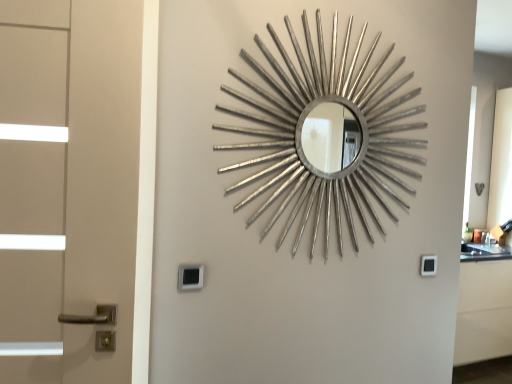
Describe the element at coordinates (325, 135) in the screenshot. I see `silver metallic mirror at center` at that location.

This screenshot has height=384, width=512. Identify the location of silver metallic mirror at center. (325, 135).

Considering the positions of objects black plastic lock at lower right, which is the second lock from left to right, and silver metallic mirror at center in the image provided, who is more to the left, black plastic lock at lower right, which is the second lock from left to right, or silver metallic mirror at center?

From the viewer's perspective, silver metallic mirror at center appears more on the left side.

Is black plastic lock at lower right, the 1th lock in the back-to-front sequence, closer to camera compared to silver metallic mirror at center?

That is False.

Can you confirm if black plastic lock at lower right, the 1th lock in the back-to-front sequence, is thinner than silver metallic mirror at center?

Yes.

From a real-world perspective, count 2nd locks downward from the silver metallic mirror at center and point to it. Please provide its 2D coordinates.

[(428, 265)]

Between black plastic lock at lower center, which appears as the 1th lock when viewed from the left, and black plastic lock at lower right, which is counted as the first lock, starting from the right, which one has more height?

black plastic lock at lower center, which appears as the 1th lock when viewed from the left, is taller.

In the scene shown: Considering the sizes of objects black plastic lock at lower center, the second lock in the right-to-left sequence, and black plastic lock at lower right, which is the second lock from left to right, in the image provided, who is smaller, black plastic lock at lower center, the second lock in the right-to-left sequence, or black plastic lock at lower right, which is the second lock from left to right,?

With smaller size is black plastic lock at lower right, which is the second lock from left to right.

Where is `lock in front of the black plastic lock at lower right, the 2th lock viewed from the front`? This screenshot has height=384, width=512. lock in front of the black plastic lock at lower right, the 2th lock viewed from the front is located at coordinates (190, 277).

Are black plastic lock at lower center, which appears as the 1th lock when viewed from the left, and black plastic lock at lower right, the 1th lock in the back-to-front sequence, making contact?

black plastic lock at lower center, which appears as the 1th lock when viewed from the left, and black plastic lock at lower right, the 1th lock in the back-to-front sequence, are clearly separated.

Which is correct: black plastic lock at lower right, the 2th lock viewed from the front, is inside black plastic lock at lower center, which appears as the 1th lock when viewed from the left, or outside of it?

The correct answer is: outside.

How far apart are black plastic lock at lower right, which is the second lock from left to right, and black plastic lock at lower center, arranged as the first lock when viewed from the front?

3.30 feet.

Is black plastic lock at lower right, which is the second lock from left to right, to the right of black plastic lock at lower center, which appears as the 1th lock when viewed from the left, from the viewer's perspective?

Yes.

Is black plastic lock at lower right, which is the second lock from left to right, with black plastic lock at lower center, the second lock in the right-to-left sequence?

No, black plastic lock at lower right, which is the second lock from left to right, is not next to black plastic lock at lower center, the second lock in the right-to-left sequence.

From the image's perspective, which is above, silver metallic mirror at center or black plastic lock at lower center, which appears as the 1th lock when viewed from the left?

silver metallic mirror at center appears higher in the image.

Consider the image. Is silver metallic mirror at center positioned with its back to black plastic lock at lower center, the second lock in the right-to-left sequence?

silver metallic mirror at center does not have its back to black plastic lock at lower center, the second lock in the right-to-left sequence.

Between point (259, 64) and point (186, 269), which one is positioned in front?

Positioned in front is point (186, 269).

Can you tell me how much silver metallic mirror at center and black plastic lock at lower center, the second lock in the right-to-left sequence, differ in facing direction?

0.174 degrees separate the facing orientations of silver metallic mirror at center and black plastic lock at lower center, the second lock in the right-to-left sequence.

Is black plastic lock at lower center, arranged as the first lock when viewed from the front, positioned beyond the bounds of silver metallic mirror at center?

Absolutely, black plastic lock at lower center, arranged as the first lock when viewed from the front, is external to silver metallic mirror at center.

Where is `design that is above the black plastic lock at lower center, which appears as the 2th lock when viewed from the back (from the image's perspective)`? design that is above the black plastic lock at lower center, which appears as the 2th lock when viewed from the back (from the image's perspective) is located at coordinates (325, 135).

Is point (186, 278) behind point (298, 233)?

No, it is in front of (298, 233).

Is the position of black plastic lock at lower center, which appears as the 2th lock when viewed from the back, less distant than that of silver metallic mirror at center?

No, black plastic lock at lower center, which appears as the 2th lock when viewed from the back, is behind silver metallic mirror at center.

Looking at the image, does silver metallic mirror at center seem bigger or smaller compared to black plastic lock at lower right, which is counted as the first lock, starting from the right?

Clearly, silver metallic mirror at center is larger in size than black plastic lock at lower right, which is counted as the first lock, starting from the right.

Measure the distance between silver metallic mirror at center and black plastic lock at lower right, the 2th lock viewed from the front.

The distance of silver metallic mirror at center from black plastic lock at lower right, the 2th lock viewed from the front, is 26.83 inches.

In the image, is silver metallic mirror at center on the left side or the right side of black plastic lock at lower right, the 1th lock in the back-to-front sequence?

Clearly, silver metallic mirror at center is on the left of black plastic lock at lower right, the 1th lock in the back-to-front sequence, in the image.

From the image's perspective, which is below, silver metallic mirror at center or black plastic lock at lower right, which is counted as the first lock, starting from the right?

black plastic lock at lower right, which is counted as the first lock, starting from the right, is shown below in the image.

The image size is (512, 384). In order to click on design on the left of black plastic lock at lower right, the 2th lock viewed from the front in this screenshot , I will do `click(325, 135)`.

Locate an element on the screen. This screenshot has width=512, height=384. lock above the black plastic lock at lower right, which is counted as the first lock, starting from the right (from a real-world perspective) is located at coordinates (190, 277).

Looking at the image, which one is located closer to black plastic lock at lower right, the 2th lock viewed from the front, silver metallic mirror at center or black plastic lock at lower center, the second lock in the right-to-left sequence?

Among the two, silver metallic mirror at center is located nearer to black plastic lock at lower right, the 2th lock viewed from the front.

Based on their spatial positions, is black plastic lock at lower right, which is the second lock from left to right, or black plastic lock at lower center, the second lock in the right-to-left sequence, further from silver metallic mirror at center?

Based on the image, black plastic lock at lower center, the second lock in the right-to-left sequence, appears to be further to silver metallic mirror at center.

When comparing their distances from black plastic lock at lower center, arranged as the first lock when viewed from the front, does silver metallic mirror at center or black plastic lock at lower right, the 2th lock viewed from the front, seem closer?

Based on the image, silver metallic mirror at center appears to be nearer to black plastic lock at lower center, arranged as the first lock when viewed from the front.

Looking at the image, which one is located closer to black plastic lock at lower center, which appears as the 2th lock when viewed from the back, black plastic lock at lower right, which is counted as the first lock, starting from the right, or silver metallic mirror at center?

silver metallic mirror at center is closer to black plastic lock at lower center, which appears as the 2th lock when viewed from the back.

Looking at the image, which one is located further to silver metallic mirror at center, black plastic lock at lower center, arranged as the first lock when viewed from the front, or black plastic lock at lower right, the 2th lock viewed from the front?

Based on the image, black plastic lock at lower center, arranged as the first lock when viewed from the front, appears to be further to silver metallic mirror at center.

Which object lies nearer to the anchor point black plastic lock at lower right, which is the second lock from left to right, black plastic lock at lower center, the second lock in the right-to-left sequence, or silver metallic mirror at center?

silver metallic mirror at center is positioned closer to the anchor black plastic lock at lower right, which is the second lock from left to right.

This screenshot has width=512, height=384. Identify the location of design located between black plastic lock at lower center, which appears as the 1th lock when viewed from the left, and black plastic lock at lower right, which is the second lock from left to right, in the left-right direction. (325, 135).